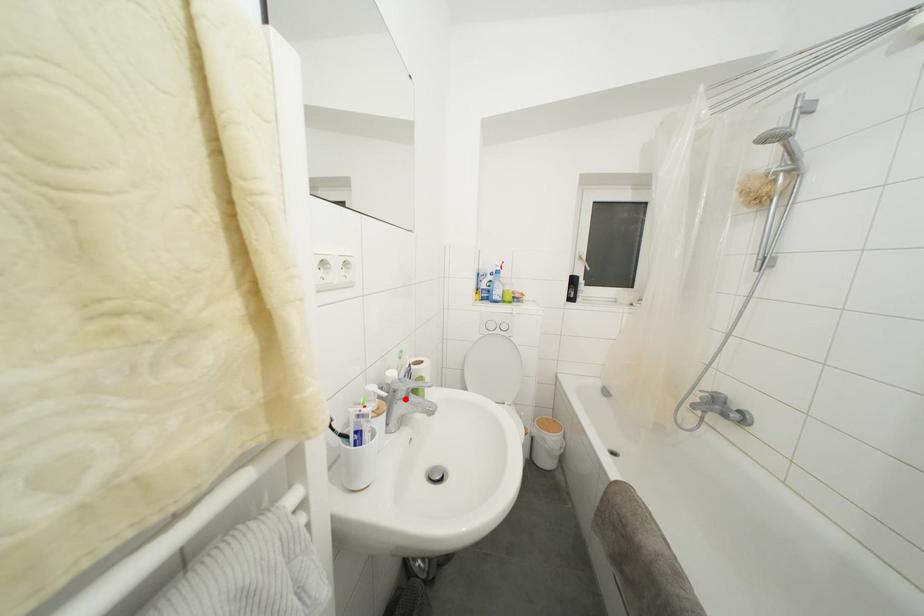
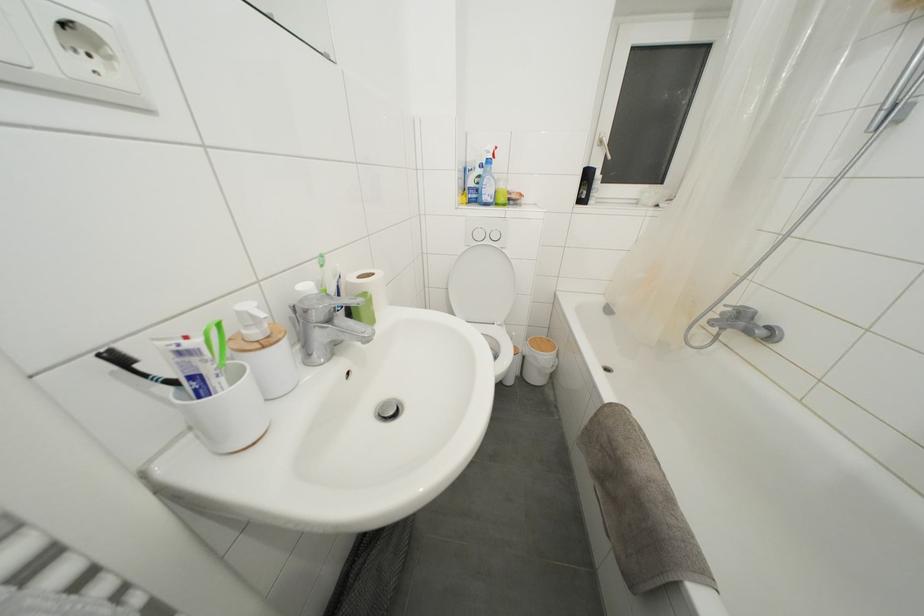
The point at the highlighted location is marked in the first image. Where is the corresponding point in the second image?

(321, 321)